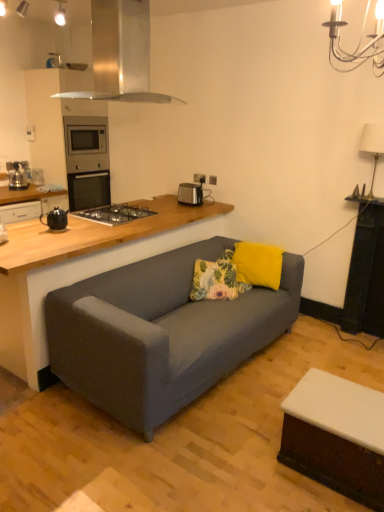
What are the coordinates of `free space to the left of black ceramic teapot at left, which is counted as the 2th appliance, starting from the top` in the screenshot? It's located at (32, 227).